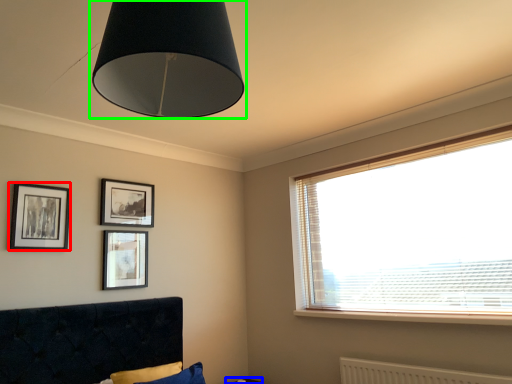
Question: Which is farther away from picture frame (highlighted by a red box)? table (highlighted by a blue box) or lamp (highlighted by a green box)?

Choices:
 (A) table
 (B) lamp

Answer: (A)